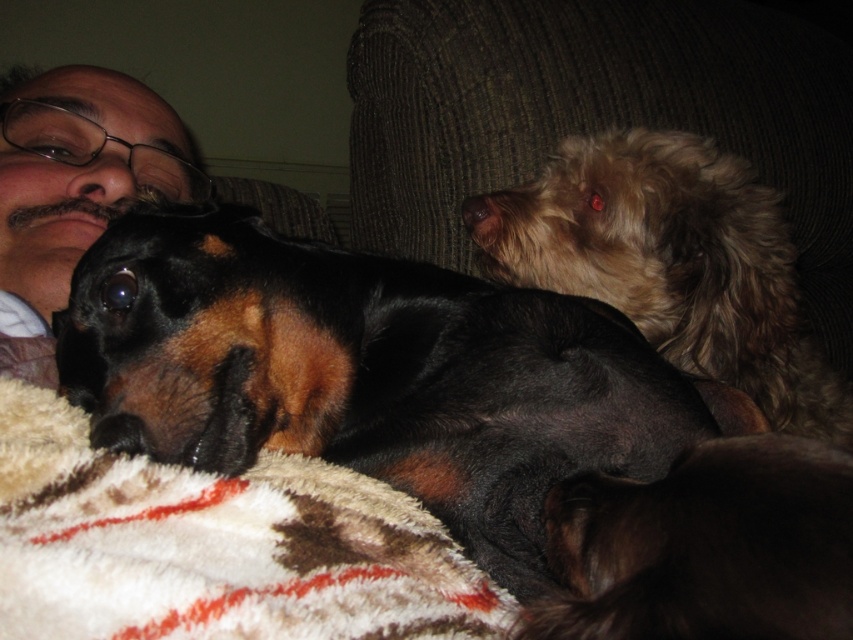
Consider the image. You are organizing a pet photo shoot and need to ensure all items fit within a 3x3 meter frame. Given the sizes of the white plush blanket at lower left and the fuzzy brown dog at upper right, will both fit comfortably within the frame?

The white plush blanket at lower left occupies less space than the fuzzy brown dog at upper right. Since the frame is 3x3 meters, both items can comfortably fit within the space as the total area required would be smaller than the frame size.